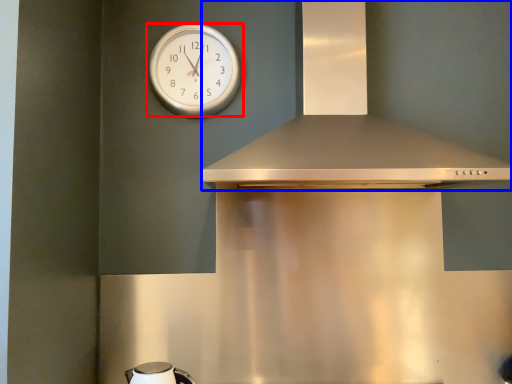
Question: Among these objects, which one is nearest to the camera, wall clock (highlighted by a red box) or vent (highlighted by a blue box)?

Choices:
 (A) wall clock
 (B) vent

Answer: (B)